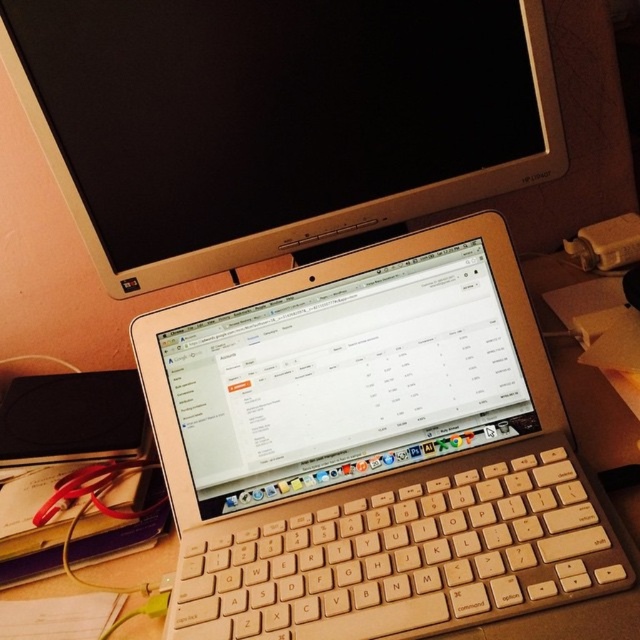
Question: Can you confirm if silver metallic laptop at center is wider than satin gold monitor at upper center?

Choices:
 (A) no
 (B) yes

Answer: (A)

Question: Which of the following is the farthest from the observer?

Choices:
 (A) (556, 436)
 (B) (515, 483)
 (C) (316, 17)

Answer: (C)

Question: Does silver metallic laptop at center have a lesser width compared to beige wood keyboard at center?

Choices:
 (A) yes
 (B) no

Answer: (B)

Question: Is silver metallic laptop at center thinner than beige wood keyboard at center?

Choices:
 (A) yes
 (B) no

Answer: (B)

Question: Based on their relative distances, which object is farther from the satin gold monitor at upper center?

Choices:
 (A) silver metallic laptop at center
 (B) beige wood keyboard at center

Answer: (B)

Question: Which of the following is the farthest from the observer?

Choices:
 (A) silver metallic laptop at center
 (B) beige wood keyboard at center
 (C) satin gold monitor at upper center

Answer: (C)